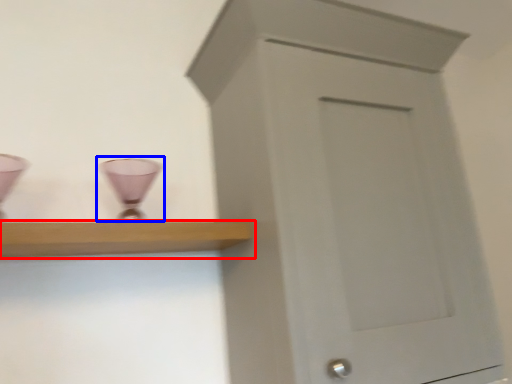
Question: Which object is further to the camera taking this photo, shelf (highlighted by a red box) or candle holder (highlighted by a blue box)?

Choices:
 (A) shelf
 (B) candle holder

Answer: (B)